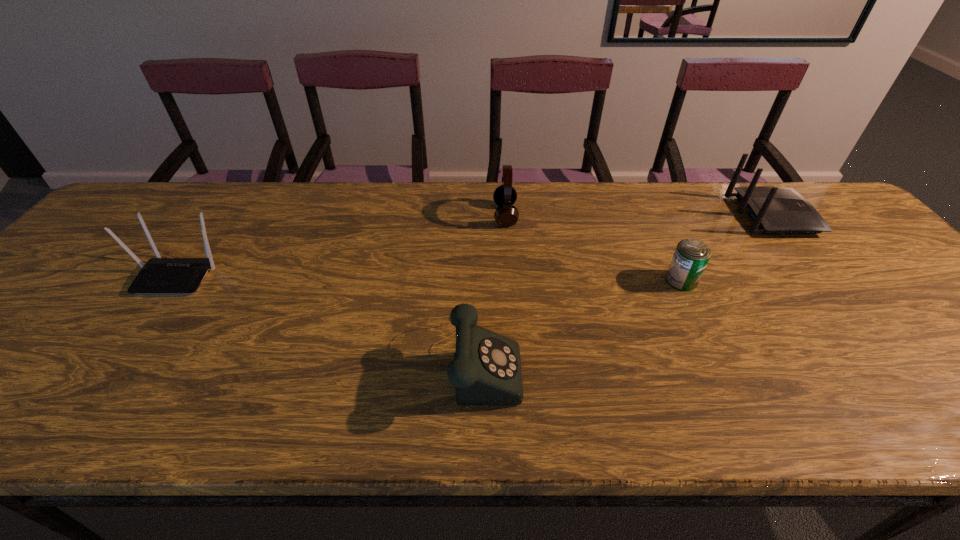
In the image, there is a desktop. Find the location of `vacant region at the far edge`. vacant region at the far edge is located at coordinates (468, 207).

Where is `vacant area at the near edge of the desktop`? vacant area at the near edge of the desktop is located at coordinates (730, 432).

Locate an element on the screen. The width and height of the screenshot is (960, 540). vacant space at the left edge is located at coordinates (19, 341).

Identify the location of free space at the far left corner of the desktop. The height and width of the screenshot is (540, 960). (147, 183).

You are a GUI agent. You are given a task and a screenshot of the screen. Output one action in this format:
    pyautogui.click(x=<x>, y=<y>)
    Task: Click on the free region at the far right corner of the desktop
    The width and height of the screenshot is (960, 540).
    Given the screenshot: What is the action you would take?
    pyautogui.click(x=777, y=183)

Find the location of `empty space that is in between the can and the left router`. empty space that is in between the can and the left router is located at coordinates (430, 277).

Image resolution: width=960 pixels, height=540 pixels. Identify the location of vacant area that lies between the right router and the headset. click(638, 215).

Find the location of `vacant space that's between the leftmost object and the nearest object`. vacant space that's between the leftmost object and the nearest object is located at coordinates (327, 317).

Find the location of `vacant space in between the rightmost object and the headset`. vacant space in between the rightmost object and the headset is located at coordinates (638, 215).

Where is `empty location between the nearest object and the rightmost object`? empty location between the nearest object and the rightmost object is located at coordinates (623, 287).